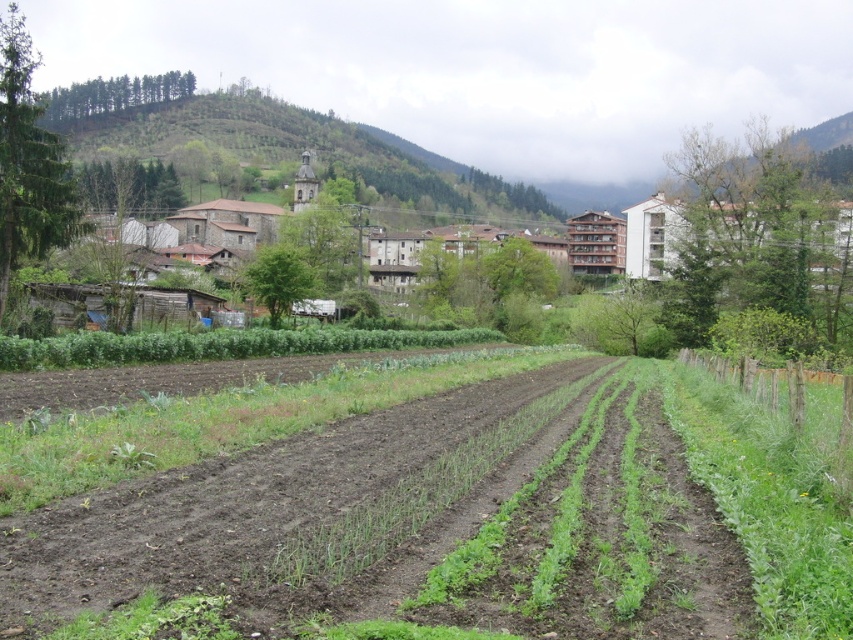
Does brown stone buildings at center have a greater width compared to green forested hillside at upper center?

No.

Between point (660, 276) and point (287, 157), which one is positioned in front?

Point (660, 276) is in front.

The height and width of the screenshot is (640, 853). I want to click on brown stone buildings at center, so click(737, 230).